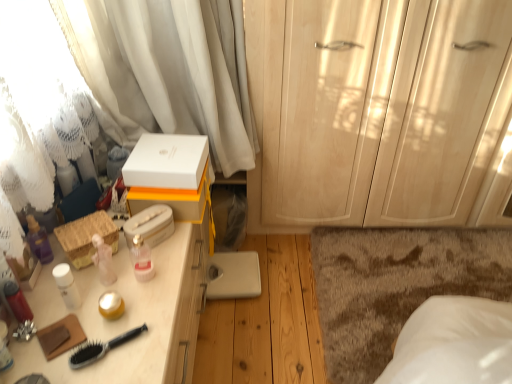
Locate an element on the screen. This screenshot has height=384, width=512. unoccupied area in front of matte wood cabinet at right is located at coordinates (369, 280).